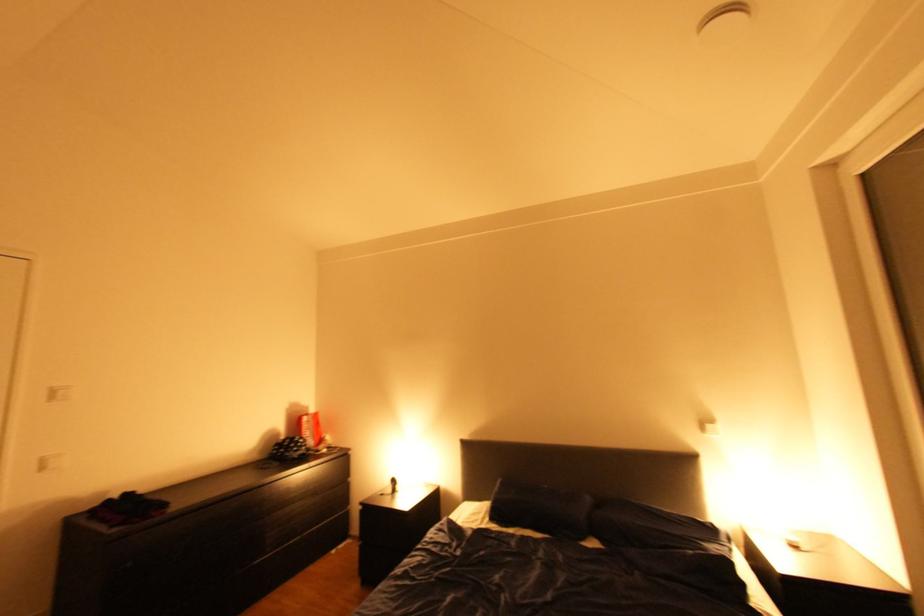
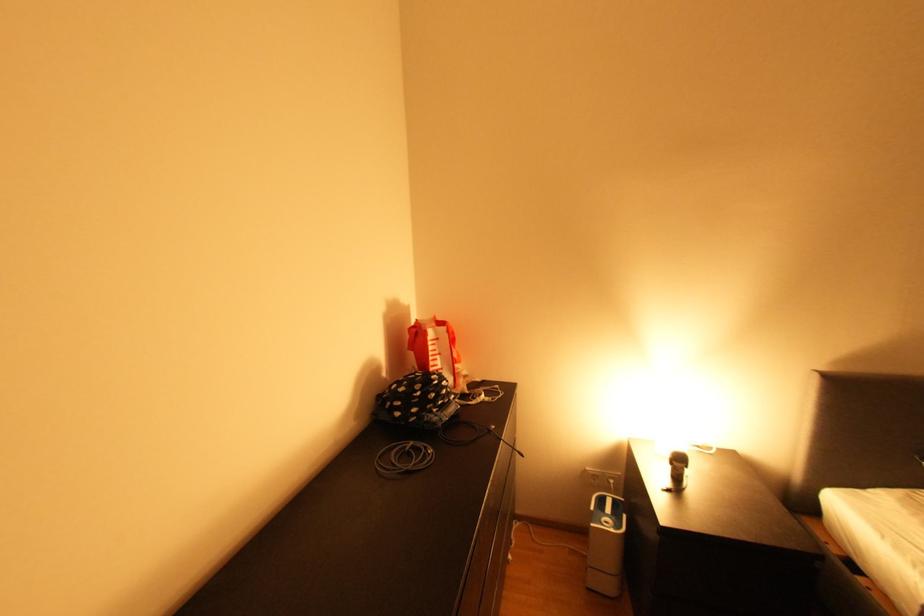
What movement of the cameraman would produce the second image?

The movement direction of the cameraman is left, forward.